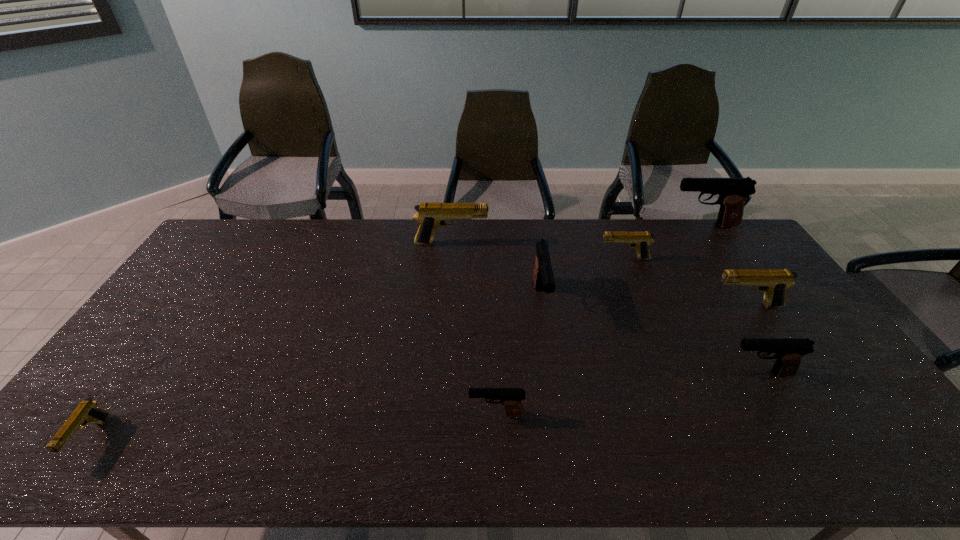
Where is `vacant space in between the rightmost tan pistol and the smallest black pistol`? The height and width of the screenshot is (540, 960). vacant space in between the rightmost tan pistol and the smallest black pistol is located at coordinates (621, 360).

Where is `unoccupied position between the leftmost object and the nearest black pistol`? The image size is (960, 540). unoccupied position between the leftmost object and the nearest black pistol is located at coordinates (294, 427).

The width and height of the screenshot is (960, 540). Identify the location of vacant area that lies between the fourth pistol from right to left and the farthest object. (663, 242).

Where is `blank region between the second nearest black pistol and the leftmost pistol`? blank region between the second nearest black pistol and the leftmost pistol is located at coordinates (425, 407).

Image resolution: width=960 pixels, height=540 pixels. What are the coordinates of `free space between the shortest pistol and the third smallest tan pistol` in the screenshot? It's located at (419, 373).

At what (x,y) coordinates should I click in order to perform the action: click on vacant area between the second nearest tan pistol and the nearest black pistol. Please return your answer as a coordinate pair (x, y). Looking at the image, I should click on (621, 360).

Where is `empty space that is in between the second smallest tan pistol and the tallest object`? This screenshot has width=960, height=540. empty space that is in between the second smallest tan pistol and the tallest object is located at coordinates (663, 242).

Find the location of `empty space that is in between the second biggest black pistol and the leftmost object`. empty space that is in between the second biggest black pistol and the leftmost object is located at coordinates (316, 369).

Locate an element on the screen. This screenshot has height=540, width=960. empty space between the shortest pistol and the fourth object from left to right is located at coordinates (316, 369).

The width and height of the screenshot is (960, 540). I want to click on object that stands as the sixth closest to the sixth farthest pistol, so [x=431, y=216].